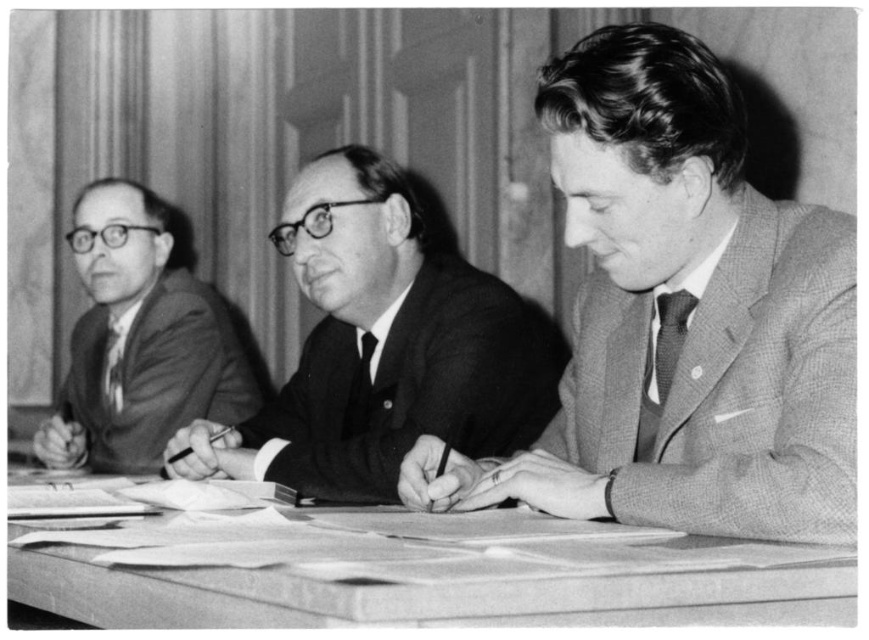
Question: Which point is closer to the camera?

Choices:
 (A) (366, 356)
 (B) (547, 467)
 (C) (198, 349)

Answer: (B)

Question: Is smooth black suit at center wider than smooth suit at left?

Choices:
 (A) yes
 (B) no

Answer: (A)

Question: Does textured gray suit at center appear over matte black tie at left?

Choices:
 (A) no
 (B) yes

Answer: (B)

Question: Which object appears closest to the camera in this image?

Choices:
 (A) checkered wool suit at right
 (B) smooth wood table at center
 (C) black silk tie at center

Answer: (B)

Question: Is textured gray suit at center behind black silk tie at center?

Choices:
 (A) no
 (B) yes

Answer: (A)

Question: Which is nearer to the patterned fabric tie at center?

Choices:
 (A) smooth wood table at center
 (B) matte silk tie at right
 (C) smooth black suit at center
 (D) smooth suit at left

Answer: (B)